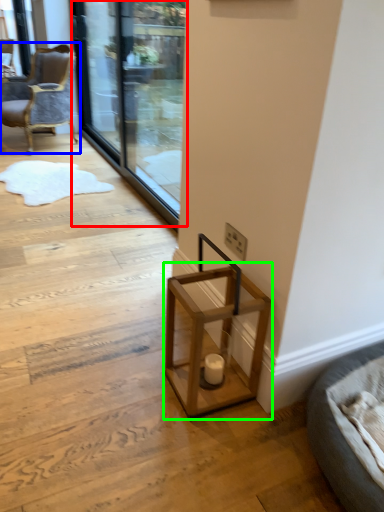
Question: Which is farther away from screen door (highlighted by a red box)? chair (highlighted by a blue box) or table (highlighted by a green box)?

Choices:
 (A) chair
 (B) table

Answer: (B)